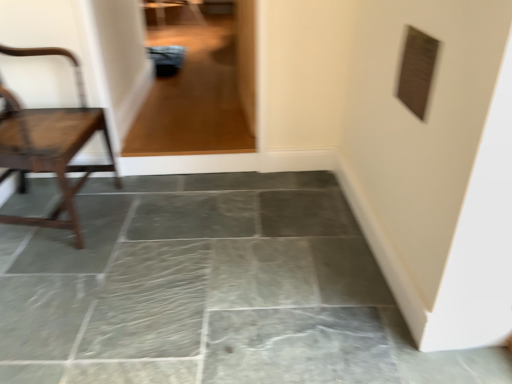
Question: Is transparent glass door at upper center not inside wooden chair at left?

Choices:
 (A) yes
 (B) no

Answer: (A)

Question: From a real-world perspective, is transparent glass door at upper center located beneath wooden chair at left?

Choices:
 (A) yes
 (B) no

Answer: (B)

Question: Is transparent glass door at upper center taller than wooden chair at left?

Choices:
 (A) no
 (B) yes

Answer: (A)

Question: From the image's perspective, does transparent glass door at upper center appear lower than wooden chair at left?

Choices:
 (A) yes
 (B) no

Answer: (B)

Question: Are transparent glass door at upper center and wooden chair at left making contact?

Choices:
 (A) no
 (B) yes

Answer: (A)

Question: Is point (35, 49) closer or farther from the camera than point (139, 344)?

Choices:
 (A) closer
 (B) farther

Answer: (B)

Question: Which is correct: wooden chair at left is inside gray stone floor at center, or outside of it?

Choices:
 (A) inside
 (B) outside

Answer: (B)

Question: From the image's perspective, is wooden chair at left positioned above or below gray stone floor at center?

Choices:
 (A) above
 (B) below

Answer: (A)

Question: Is wooden chair at left bigger or smaller than gray stone floor at center?

Choices:
 (A) small
 (B) big

Answer: (B)

Question: Considering the relative positions of wooden chair at left and transparent glass door at upper center in the image provided, is wooden chair at left to the left or to the right of transparent glass door at upper center?

Choices:
 (A) right
 (B) left

Answer: (B)

Question: Considering their positions, is wooden chair at left located in front of or behind transparent glass door at upper center?

Choices:
 (A) front
 (B) behind

Answer: (A)

Question: From a real-world perspective, relative to transparent glass door at upper center, is wooden chair at left vertically above or below?

Choices:
 (A) above
 (B) below

Answer: (B)

Question: Is point (41, 51) closer or farther from the camera than point (252, 92)?

Choices:
 (A) farther
 (B) closer

Answer: (B)

Question: In terms of height, does transparent glass door at upper center look taller or shorter compared to gray stone floor at center?

Choices:
 (A) tall
 (B) short

Answer: (A)

Question: Does point (252, 29) appear closer or farther from the camera than point (52, 322)?

Choices:
 (A) closer
 (B) farther

Answer: (B)